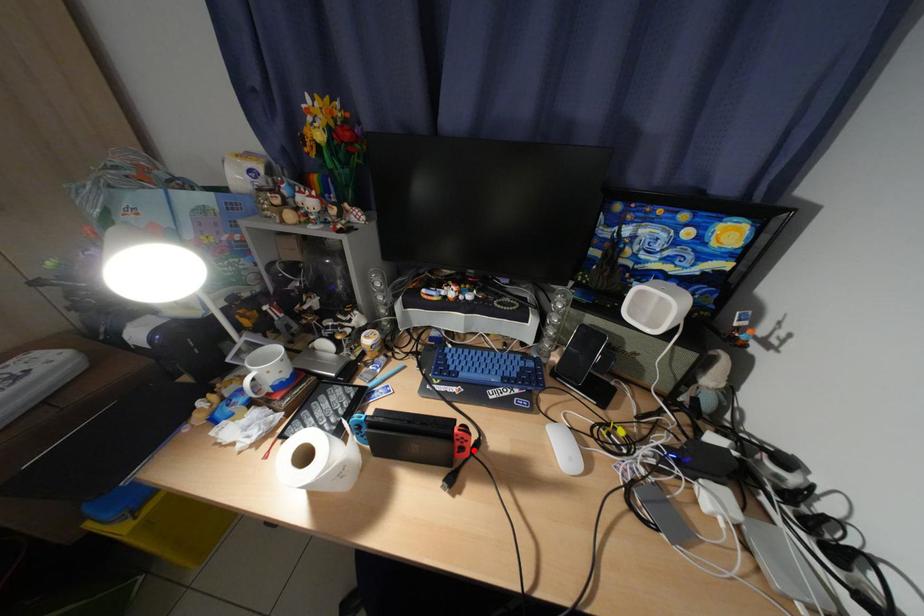
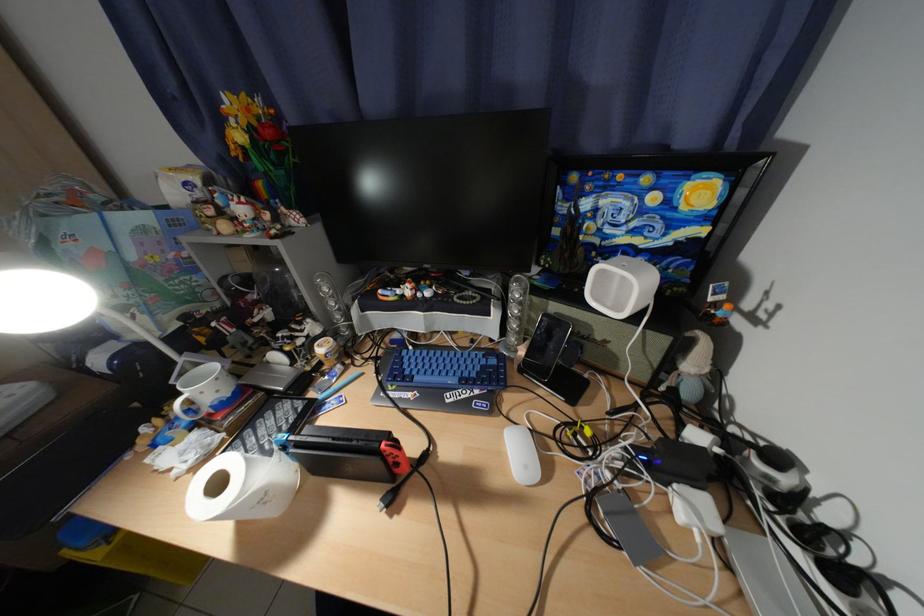
Where in the second image is the point corresponding to the highlighted location from the first image?

(408, 466)